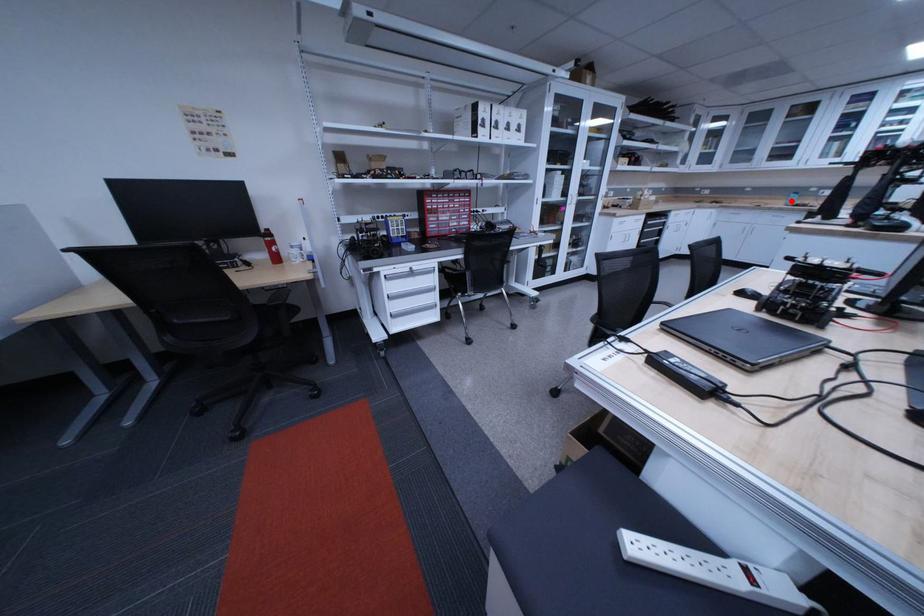
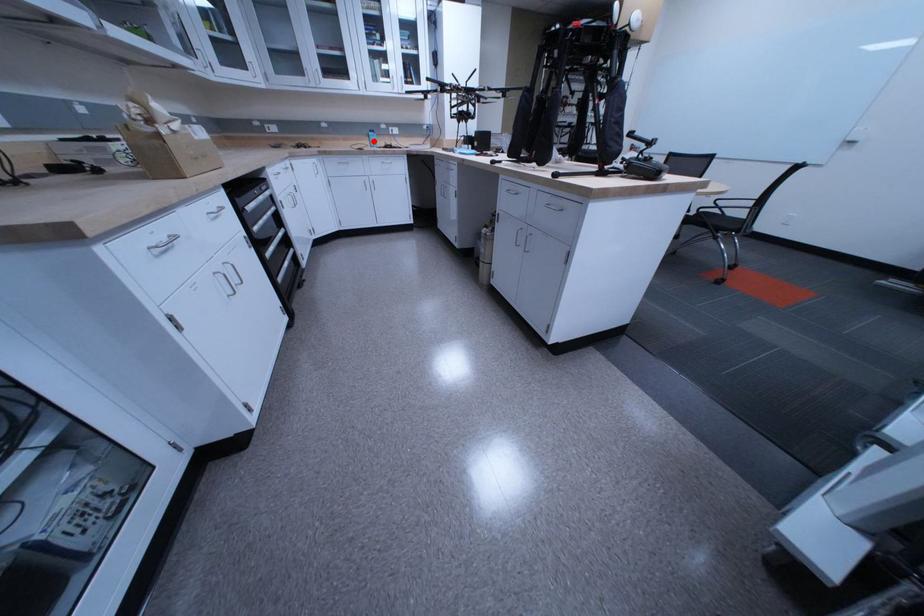
I am providing you with two images of the same scene from different viewpoints. A red point is marked on the first image and another point is marked on the second image. Is the marked point in image1 the same physical position as the marked point in image2?

Yes